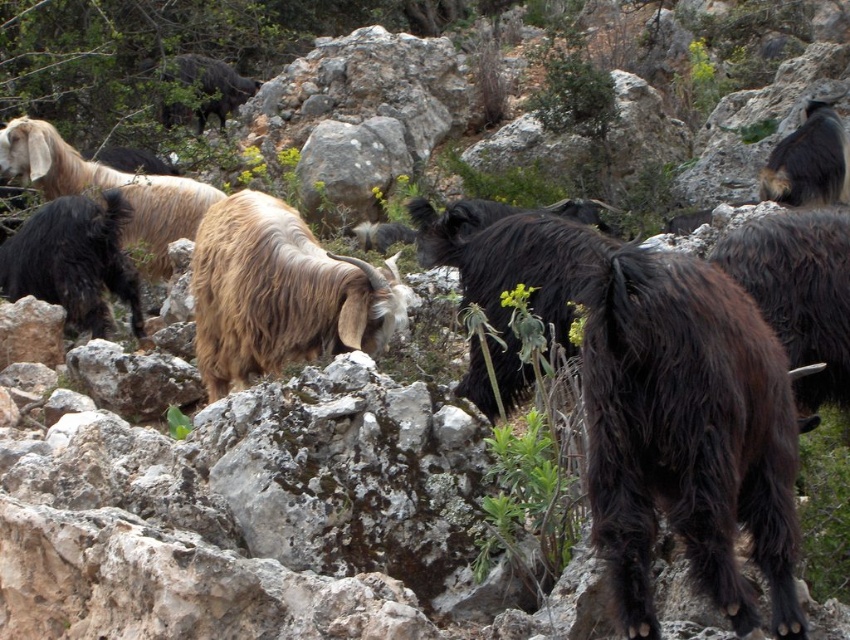
Can you confirm if dark brown woolen ram at upper right is taller than dark brown woolen ram at upper center?

No, dark brown woolen ram at upper right is not taller than dark brown woolen ram at upper center.

Does point (812, 184) lie in front of point (251, 92)?

Yes, point (812, 184) is in front of point (251, 92).

The image size is (850, 640). In order to click on dark brown woolen ram at upper right in this screenshot , I will do `click(809, 161)`.

Who is shorter, dark brown woolen goat at left or dark brown woolen ram at upper center?

Standing shorter between the two is dark brown woolen goat at left.

Locate an element on the screen. This screenshot has width=850, height=640. dark brown woolen goat at left is located at coordinates (72, 260).

Can you confirm if light brown woolly goat at upper left is smaller than dark brown woolen ram at upper right?

Incorrect, light brown woolly goat at upper left is not smaller in size than dark brown woolen ram at upper right.

Does light brown woolly goat at upper left have a greater width compared to dark brown woolen ram at upper right?

Correct, the width of light brown woolly goat at upper left exceeds that of dark brown woolen ram at upper right.

Is point (128, 179) in front of point (817, 120)?

Yes.

The width and height of the screenshot is (850, 640). In order to click on light brown woolly goat at upper left in this screenshot , I will do (x=108, y=188).